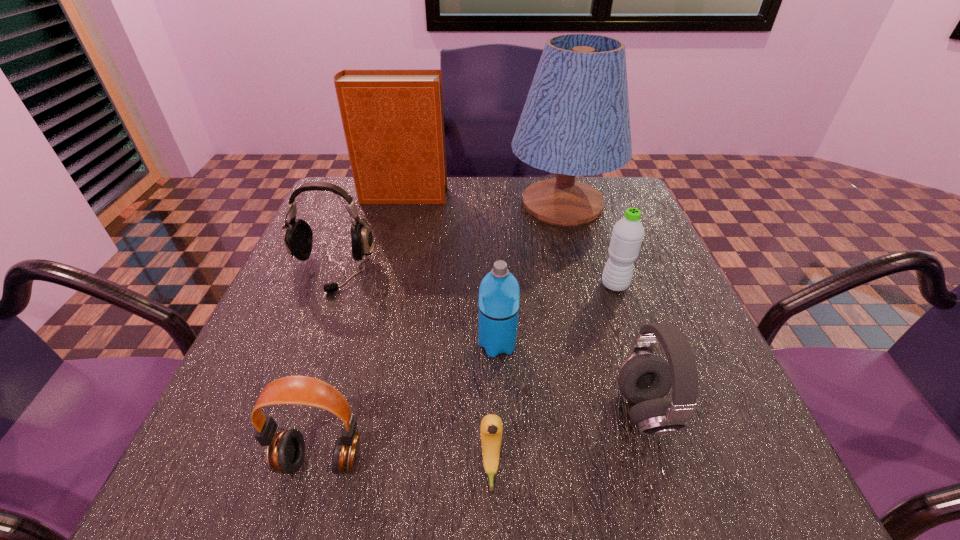
The width and height of the screenshot is (960, 540). In the image, there is a desktop. Identify the location of vacant space at the near right corner. (761, 447).

Locate an element on the screen. The width and height of the screenshot is (960, 540). free spot between the thermos bottle and the banana is located at coordinates (494, 407).

At what (x,y) coordinates should I click in order to perform the action: click on vacant area between the thermos bottle and the rightmost headset. Please return your answer as a coordinate pair (x, y). This screenshot has width=960, height=540. Looking at the image, I should click on (571, 378).

At what (x,y) coordinates should I click in order to perform the action: click on blank region between the lampshade and the water bottle. Please return your answer as a coordinate pair (x, y). Looking at the image, I should click on (588, 244).

Find the location of a particular element. free spot between the tallest object and the banana is located at coordinates (527, 336).

Identify the location of vacant space that's between the lampshade and the rightmost headset. The width and height of the screenshot is (960, 540). (604, 308).

Image resolution: width=960 pixels, height=540 pixels. In order to click on free space between the banana and the tallest object in this screenshot , I will do `click(527, 336)`.

This screenshot has height=540, width=960. What are the coordinates of `free space that is in between the hardback book and the shortest object` in the screenshot? It's located at (446, 332).

Point out which object is positioned as the nearest to the water bottle. Please provide its 2D coordinates. Your answer should be formatted as a tuple, i.e. [(x, y)], where the tuple contains the x and y coordinates of a point satisfying the conditions above.

[(575, 122)]

This screenshot has width=960, height=540. I want to click on object identified as the fifth closest to the rightmost headset, so click(x=575, y=122).